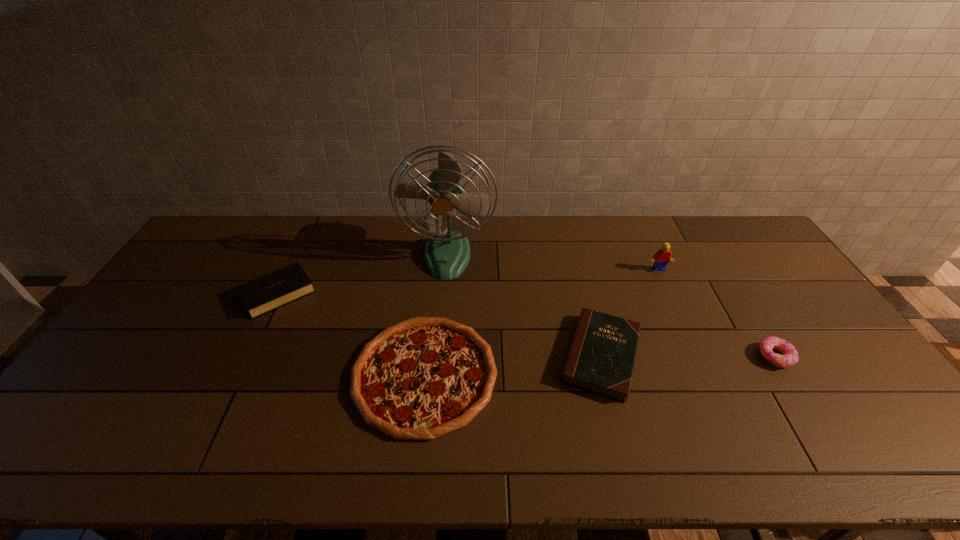
Identify the location of vacant space located 0.270m on the back of the fourth object from left to right. The image size is (960, 540). (576, 259).

Find the location of a particular element. vacant space positioned 0.150m on the front of the doughnut is located at coordinates (816, 422).

I want to click on free spot located 0.400m on the left of the shortest object, so click(201, 374).

I want to click on object that is at the far edge, so click(447, 253).

Identify the location of object at the near edge. This screenshot has width=960, height=540. (419, 379).

Where is `object that is positioned at the right edge`? This screenshot has width=960, height=540. object that is positioned at the right edge is located at coordinates (790, 356).

I want to click on vacant space at the far edge, so click(588, 244).

At what (x,y) coordinates should I click in order to perform the action: click on vacant space at the near edge of the desktop. Please return your answer as a coordinate pair (x, y). This screenshot has height=540, width=960. Looking at the image, I should click on [643, 444].

The height and width of the screenshot is (540, 960). Find the location of `vacant space at the left edge of the desktop`. vacant space at the left edge of the desktop is located at coordinates (188, 317).

This screenshot has height=540, width=960. Find the location of `vacant space at the right edge`. vacant space at the right edge is located at coordinates click(760, 273).